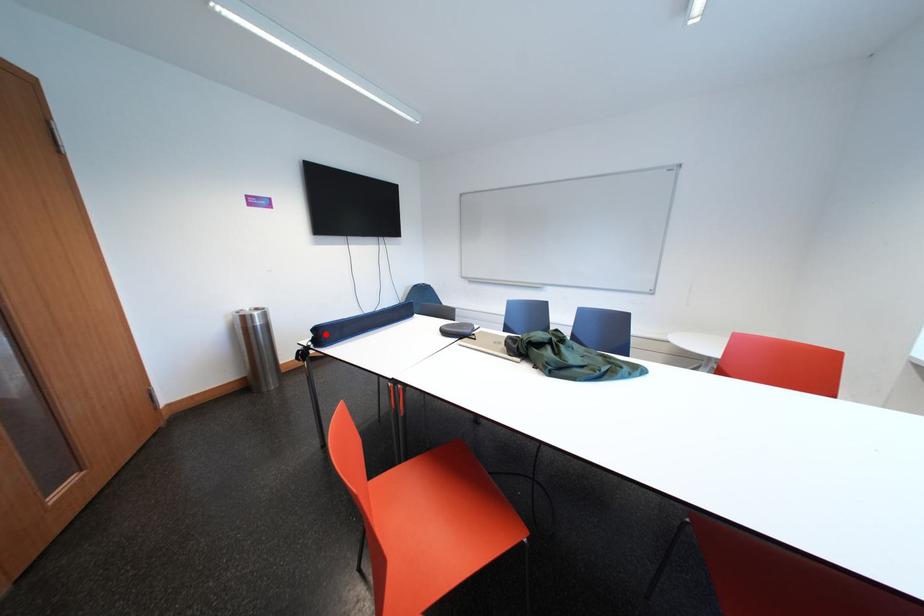
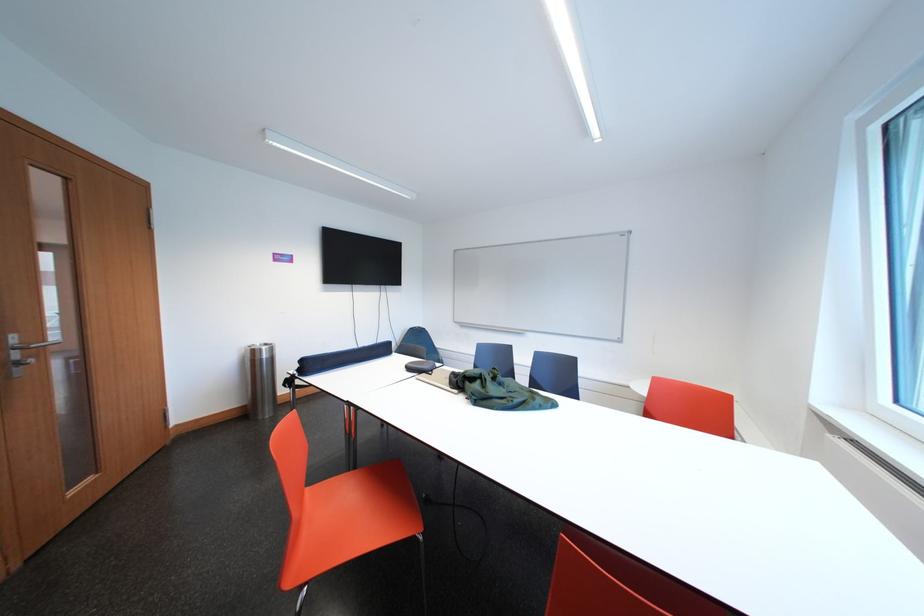
Find the pixel in the second image that matches the highlighted location in the first image.

(311, 365)